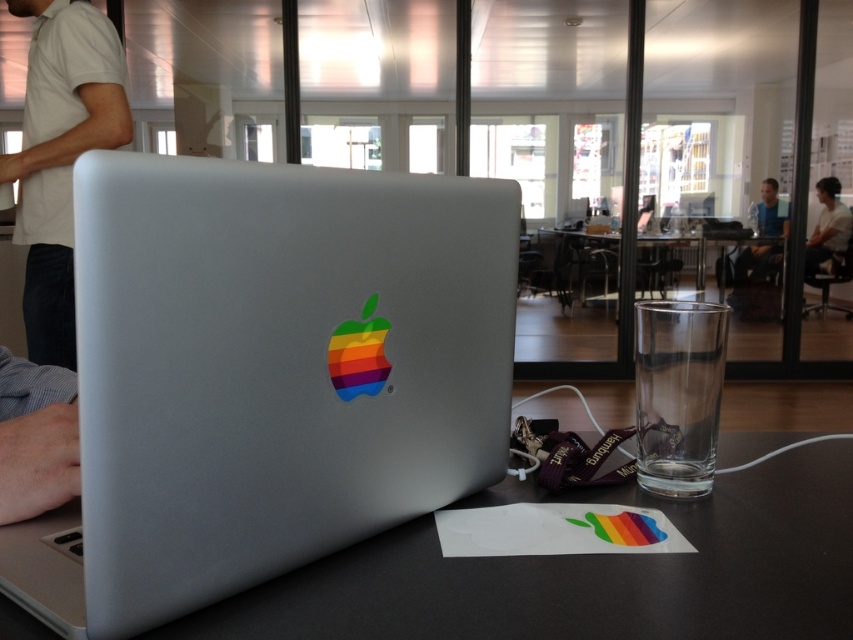
Looking at this image, you are organizing your desk and want to place a new item exactly at the point with coordinates (x=265, y=376). According to the scene, what object is currently located at that position?

The point at coordinates (x=265, y=376) corresponds to the satin silver laptop at center, so the object currently at that position is the satin silver laptop at center.

You are a delivery robot with a 2 meter wide package. You need to move from the white cotton shirt at upper left to the matte blue shirt at upper right. Can you fit through the space between them?

The distance between the white cotton shirt at upper left and the matte blue shirt at upper right is 3.98 meters. Since the package is 2 meters wide, the robot can easily navigate through the space between them as the distance is sufficient to accommodate the package width.